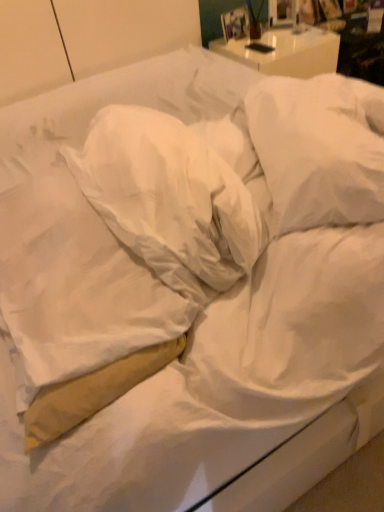
Question: Considering the positions of white soft pillow at center, which appears as the second pillow when viewed from the left, and white soft pillow at upper right, which appears as the 1th pillow when viewed from the right, in the image, is white soft pillow at center, which appears as the second pillow when viewed from the left, bigger or smaller than white soft pillow at upper right, which appears as the 1th pillow when viewed from the right,?

Choices:
 (A) big
 (B) small

Answer: (A)

Question: From a real-world perspective, is white soft pillow at center, which appears as the second pillow when viewed from the left, above or below white soft pillow at upper right, which appears as the 1th pillow when viewed from the right?

Choices:
 (A) below
 (B) above

Answer: (B)

Question: Which of these objects is positioned closest to the white soft pillow at center, the 2th pillow when ordered from right to left?

Choices:
 (A) tan fabric pillow at left, which ranks as the 1th pillow in left-to-right order
 (B) white soft pillow at upper right, which is the third pillow from left to right

Answer: (A)

Question: Which is farther from the white soft pillow at center, which appears as the second pillow when viewed from the left?

Choices:
 (A) tan fabric pillow at left, which ranks as the 1th pillow in left-to-right order
 (B) white soft pillow at upper right, which is the third pillow from left to right

Answer: (B)